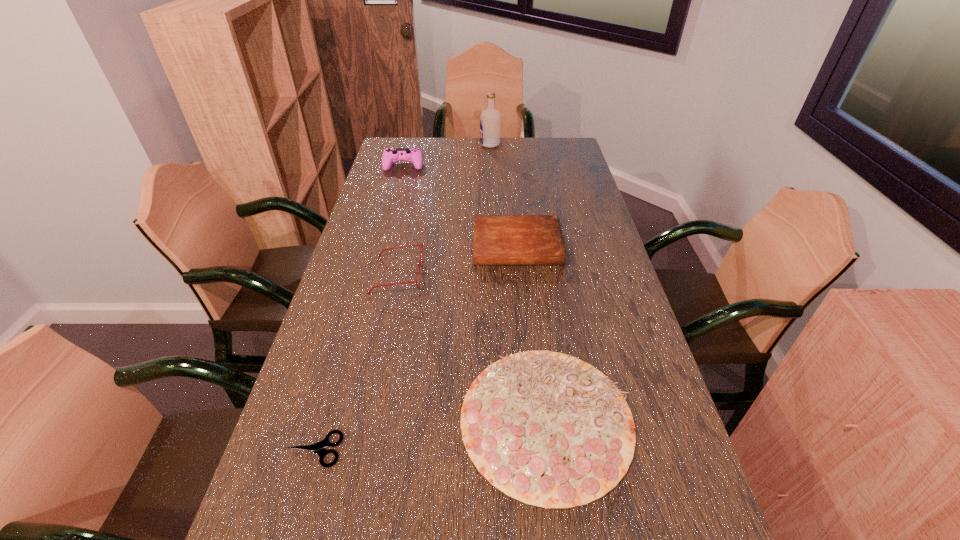
Locate an element on the screen. free space between the vodka and the shears is located at coordinates (402, 297).

Where is `empty space between the farthest object and the spectacles`? empty space between the farthest object and the spectacles is located at coordinates (444, 210).

Identify the location of free point between the fifth nearest object and the pizza. (475, 292).

Where is `empty space between the Bible and the pizza`? empty space between the Bible and the pizza is located at coordinates (532, 332).

At what (x,y) coordinates should I click in order to perform the action: click on free space between the pizza and the Bible. Please return your answer as a coordinate pair (x, y). The image size is (960, 540). Looking at the image, I should click on (532, 332).

You are a GUI agent. You are given a task and a screenshot of the screen. Output one action in this format:
    pyautogui.click(x=<x>, y=<y>)
    Task: Click on the vacant space in between the Bible and the control
    
    Given the screenshot: What is the action you would take?
    pyautogui.click(x=461, y=206)

Locate an element on the screen. vacant space that is in between the Bible and the second farthest object is located at coordinates (461, 206).

Where is `object that can be found as the fourth closest to the shears`? The height and width of the screenshot is (540, 960). object that can be found as the fourth closest to the shears is located at coordinates (414, 155).

This screenshot has height=540, width=960. In order to click on object that is the third closest to the shortest object in this screenshot , I will do `click(498, 239)`.

Image resolution: width=960 pixels, height=540 pixels. I want to click on vacant space that satisfies the following two spatial constraints: 1. on the label of the pizza; 2. on the right side of the vodka, so click(500, 418).